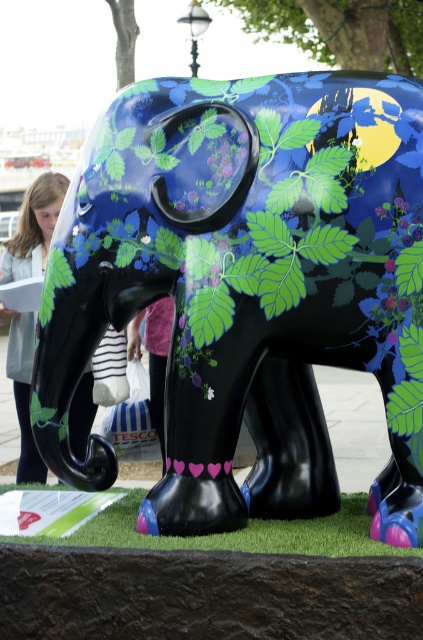
How distant is glossy painted elephant at center from blonde hair at left?

glossy painted elephant at center and blonde hair at left are 6.94 feet apart from each other.

Is glossy painted elephant at center shorter than blonde hair at left?

Incorrect, glossy painted elephant at center's height does not fall short of blonde hair at left's.

What do you see at coordinates (247, 285) in the screenshot?
I see `glossy painted elephant at center` at bounding box center [247, 285].

Where is `glossy painted elephant at center`? glossy painted elephant at center is located at coordinates 247,285.